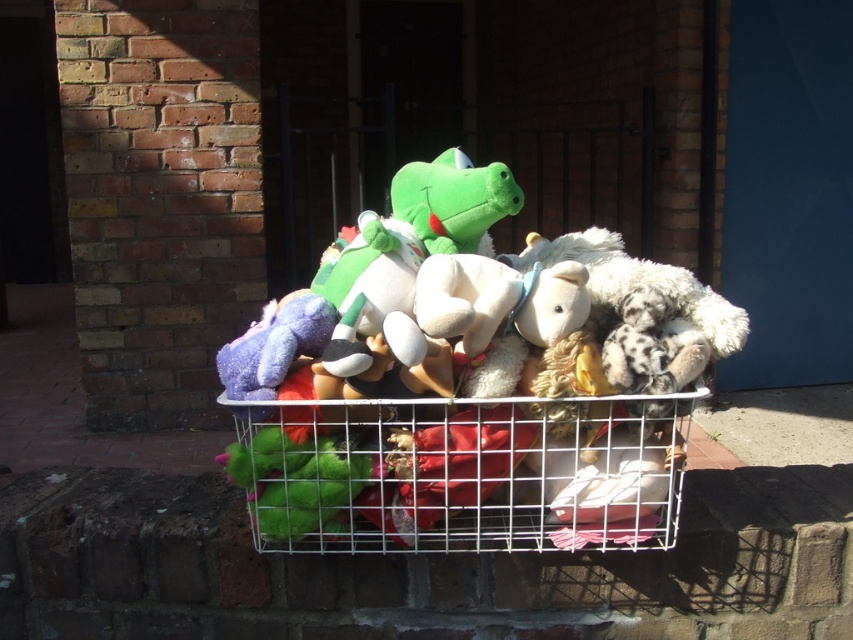
Can you confirm if soft plush toys at center is bigger than white wire shopping basket at center?

Indeed, soft plush toys at center has a larger size compared to white wire shopping basket at center.

From the picture: Does soft plush toys at center have a greater width compared to white wire shopping basket at center?

Yes.

This screenshot has height=640, width=853. In order to click on soft plush toys at center in this screenshot , I will do `click(463, 392)`.